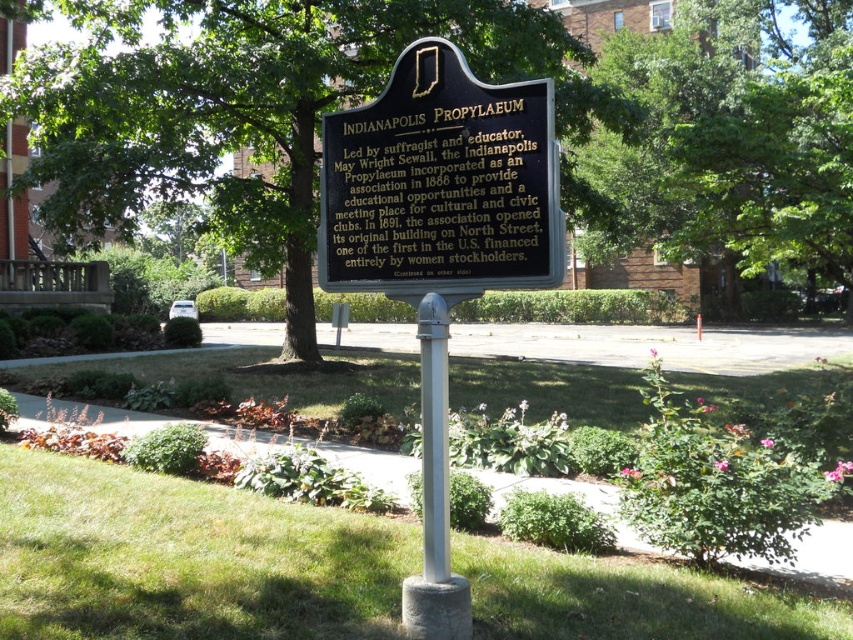
Question: Which point is farther to the camera?

Choices:
 (A) (397, 48)
 (B) (386, 230)

Answer: (A)

Question: Can you confirm if green leafy tree at center is positioned to the left of silver metallic pole at center?

Choices:
 (A) yes
 (B) no

Answer: (A)

Question: Is green leafy tree at center closer to camera compared to green leafy tree at upper center?

Choices:
 (A) no
 (B) yes

Answer: (B)

Question: Estimate the real-world distances between objects in this image. Which object is farther from the black polished stone plaque at center?

Choices:
 (A) green leafy tree at upper center
 (B) silver metallic pole at center
 (C) black metal plaque at center

Answer: (A)

Question: Which of the following is the closest to the observer?

Choices:
 (A) (32, 113)
 (B) (338, 275)

Answer: (B)

Question: Can you confirm if green leafy tree at center is wider than green leafy tree at upper center?

Choices:
 (A) no
 (B) yes

Answer: (A)